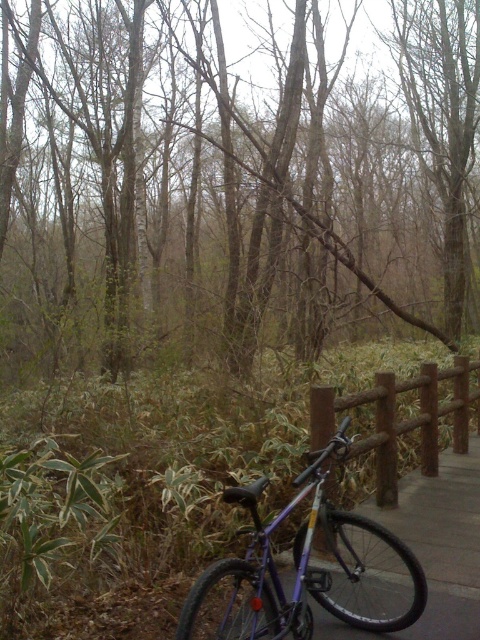
Does brown matte tree at center appear on the right side of purple matte mountain bike at center?

No, brown matte tree at center is not to the right of purple matte mountain bike at center.

Between point (252, 140) and point (388, 576), which one is positioned in front?

Point (388, 576) is in front.

This screenshot has width=480, height=640. Describe the element at coordinates (229, 182) in the screenshot. I see `brown matte tree at center` at that location.

Identify the location of brown matte tree at center. (229, 182).

Can you confirm if brown matte tree at center is wider than brown wooden rail at right?

Indeed, brown matte tree at center has a greater width compared to brown wooden rail at right.

Between brown matte tree at center and brown wooden rail at right, which one appears on the right side from the viewer's perspective?

brown wooden rail at right is more to the right.

Is point (121, 134) closer to camera compared to point (384, 499)?

No, it is not.

I want to click on brown matte tree at center, so click(x=229, y=182).

Who is positioned more to the right, purple matte mountain bike at center or brown wooden rail at right?

brown wooden rail at right is more to the right.

Who is more distant from viewer, (288,608) or (459,374)?

Positioned behind is point (459,374).

The height and width of the screenshot is (640, 480). In order to click on purple matte mountain bike at center in this screenshot , I will do `click(300, 570)`.